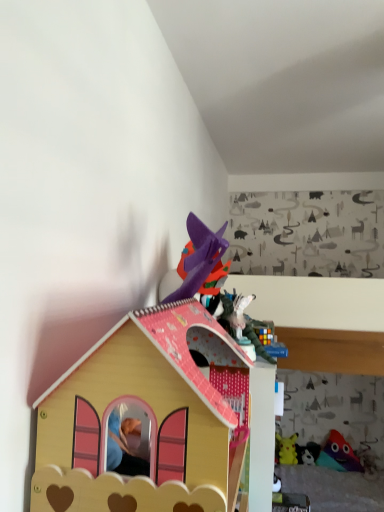
Question: Considering the relative sizes of multicolored plush toy at lower right, marked as the second toy in a top-to-bottom arrangement, and wooden dollhouse at center, arranged as the 5th toy when viewed from the right, in the image provided, is multicolored plush toy at lower right, marked as the second toy in a top-to-bottom arrangement, thinner than wooden dollhouse at center, arranged as the 5th toy when viewed from the right,?

Choices:
 (A) yes
 (B) no

Answer: (A)

Question: Is wooden dollhouse at center, arranged as the 5th toy when viewed from the right, a part of multicolored plush toy at lower right, marked as the second toy in a top-to-bottom arrangement?

Choices:
 (A) yes
 (B) no

Answer: (B)

Question: Can you confirm if multicolored plush toy at lower right, acting as the second toy starting from the right, is wider than wooden dollhouse at center, the fifth toy from the bottom?

Choices:
 (A) no
 (B) yes

Answer: (A)

Question: Is multicolored plush toy at lower right, positioned as the third toy in back-to-front order, completely or partially outside of wooden dollhouse at center, the fifth toy in the back-to-front sequence?

Choices:
 (A) no
 (B) yes

Answer: (B)

Question: From the image's perspective, is multicolored plush toy at lower right, the 4th toy positioned from the left, beneath wooden dollhouse at center, positioned as the first toy in top-to-bottom order?

Choices:
 (A) yes
 (B) no

Answer: (A)

Question: Can you confirm if multicolored plush toy at lower right, the 4th toy positioned from the left, is positioned to the left of wooden dollhouse at center, the 1th toy from the front?

Choices:
 (A) no
 (B) yes

Answer: (A)

Question: Does yellow plush toy at upper right, which ranks as the second toy in left-to-right order, have a lesser height compared to white matte plush toy at lower right, placed as the 2th toy when sorted from bottom to top?

Choices:
 (A) yes
 (B) no

Answer: (B)

Question: Does yellow plush toy at upper right, which ranks as the second toy in left-to-right order, have a larger size compared to white matte plush toy at lower right, arranged as the third toy when viewed from the right?

Choices:
 (A) yes
 (B) no

Answer: (A)

Question: Does yellow plush toy at upper right, which ranks as the second toy in left-to-right order, turn towards white matte plush toy at lower right, placed as the 2th toy when sorted from bottom to top?

Choices:
 (A) yes
 (B) no

Answer: (B)

Question: From the image's perspective, would you say yellow plush toy at upper right, marked as the 5th toy in a front-to-back arrangement, is shown under white matte plush toy at lower right, placed as the 2th toy when sorted from bottom to top?

Choices:
 (A) yes
 (B) no

Answer: (B)

Question: Is yellow plush toy at upper right, the 3th toy ordered from the bottom, smaller than white matte plush toy at lower right, arranged as the third toy when viewed from the right?

Choices:
 (A) yes
 (B) no

Answer: (B)

Question: Does yellow plush toy at upper right, the 3th toy ordered from the bottom, contain white matte plush toy at lower right, arranged as the third toy when viewed from the right?

Choices:
 (A) no
 (B) yes

Answer: (A)

Question: Can you confirm if yellow plush toy at upper right, the 3th toy ordered from the bottom, is bigger than rubber duck at lower right, the first toy when ordered from right to left?

Choices:
 (A) yes
 (B) no

Answer: (B)